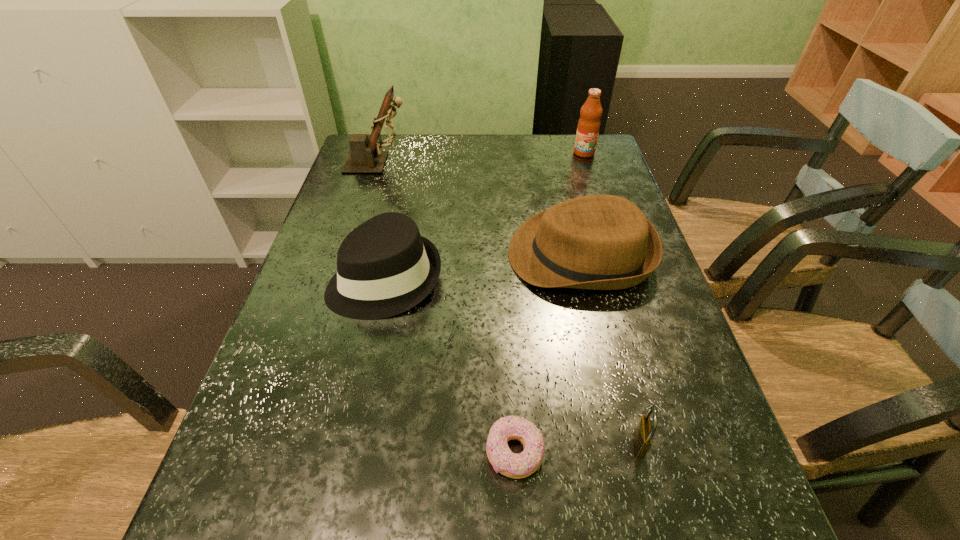
Locate an element on the screen. Image resolution: width=960 pixels, height=540 pixels. free space located 0.220m on the front-facing side of the right fedora is located at coordinates (419, 255).

Where is `vacant area situated 0.120m on the front-facing side of the right fedora`? This screenshot has height=540, width=960. vacant area situated 0.120m on the front-facing side of the right fedora is located at coordinates (460, 255).

This screenshot has width=960, height=540. What are the coordinates of `blank area located on the front of the padlock` in the screenshot? It's located at (657, 509).

Find the location of `blank area located on the left of the shortest object`. blank area located on the left of the shortest object is located at coordinates (456, 453).

The image size is (960, 540). In order to click on figurine that is at the far edge in this screenshot , I will do `click(366, 156)`.

Find the location of a particular element. fruit juice situated at the far edge is located at coordinates (588, 127).

Identify the location of figurine situated at the left edge. (366, 156).

You are a GUI agent. You are given a task and a screenshot of the screen. Output one action in this format:
    pyautogui.click(x=<x>, y=<y>)
    Task: Click on the fedora positioned at the left edge
    This screenshot has height=540, width=960.
    Given the screenshot: What is the action you would take?
    pyautogui.click(x=385, y=267)

Locate an element on the screen. This screenshot has width=960, height=540. fruit juice that is at the right edge is located at coordinates (588, 127).

The height and width of the screenshot is (540, 960). Identify the location of fedora that is at the right edge. (600, 242).